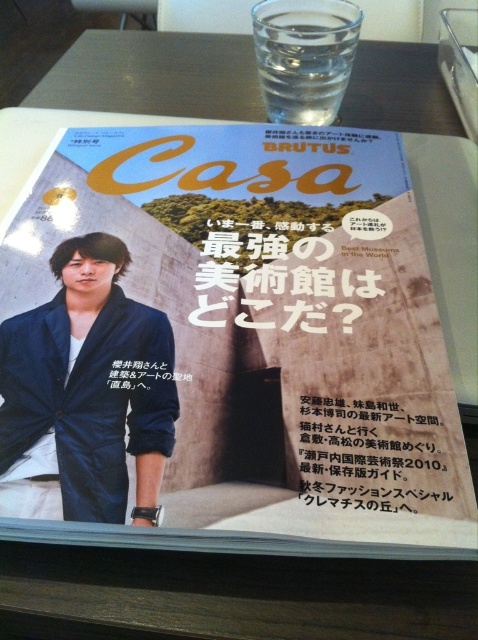
Question: Which is nearer to the clear glass water at upper center?

Choices:
 (A) satin blue blazer at left
 (B) blue fabric magazine at center

Answer: (B)

Question: Observing the image, what is the correct spatial positioning of blue fabric magazine at center in reference to black paper at center?

Choices:
 (A) below
 (B) above

Answer: (B)

Question: Which object is positioned farthest from the black paper at center?

Choices:
 (A) clear glass water at upper center
 (B) blue fabric magazine at center

Answer: (A)

Question: Does blue fabric magazine at center have a greater width compared to satin blue blazer at left?

Choices:
 (A) no
 (B) yes

Answer: (B)

Question: Can you confirm if blue fabric magazine at center is wider than clear glass water at upper center?

Choices:
 (A) no
 (B) yes

Answer: (B)

Question: Which point appears farthest from the camera in this image?

Choices:
 (A) (132, 340)
 (B) (274, 58)
 (C) (312, 456)

Answer: (B)